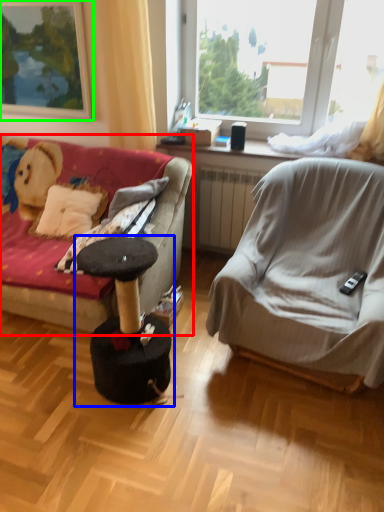
Question: Considering the real-world distances, which object is farthest from studio couch (highlighted by a red box)? music stool (highlighted by a blue box) or picture frame (highlighted by a green box)?

Choices:
 (A) music stool
 (B) picture frame

Answer: (B)